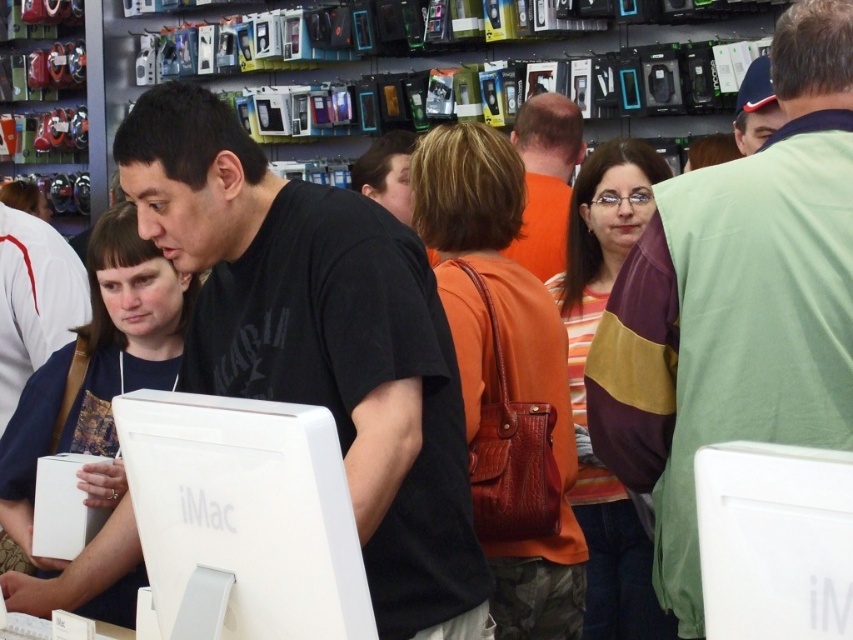
You are a customer in an electronics store looking for an iMac. You see the white matte imac at center and the orange fabric shirt at center. Which object is located lower in the scene?

The white matte imac at center is positioned under the orange fabric shirt at center, so the imac is lower than the shirt.

You are a customer in the electronics store and you want to place your brown leather purse at center on the counter near the blue fabric cap at upper right. The counter is 4 feet away from where you are standing. Can you reach the counter without moving your feet?

The brown leather purse at center is 3.60 feet away from the blue fabric cap at upper right. Since the counter is 4 feet away from you, you can reach the counter without moving your feet as the distance is within your reach.